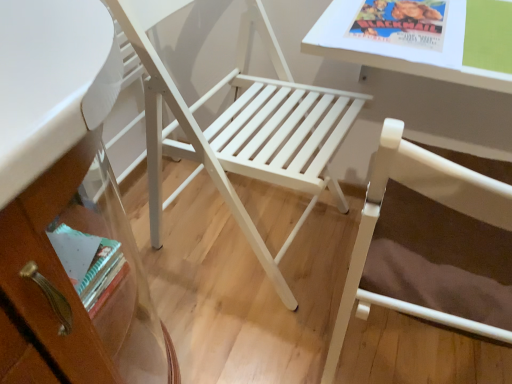
Find the location of a particular element. This screenshot has height=384, width=512. free space in front of white wood chair at center, placed as the first chair when sorted from left to right is located at coordinates (239, 329).